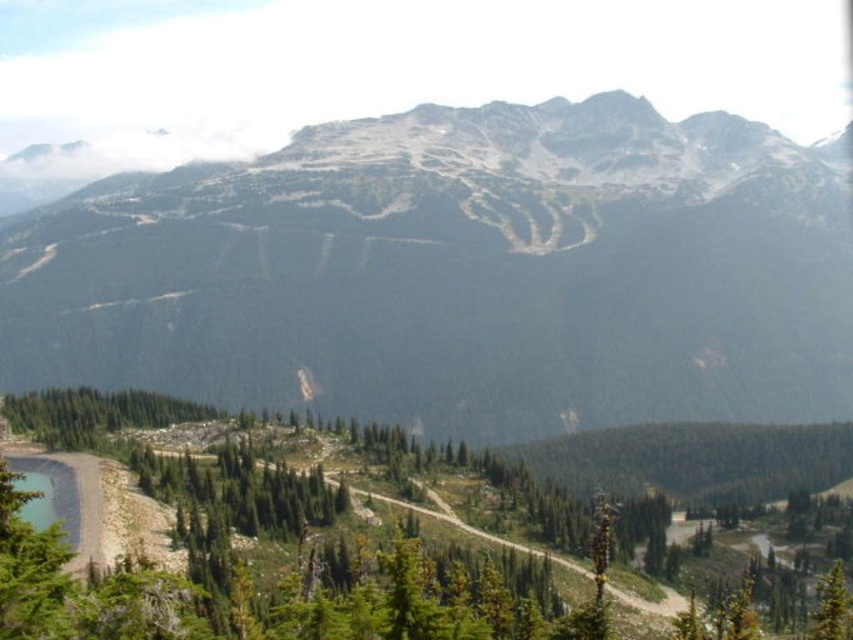
Question: Which of the following is the closest to the observer?

Choices:
 (A) green textured tree at center
 (B) rocky mountain at center
 (C) green matte tree at lower right

Answer: (A)

Question: Which point is closer to the camera?

Choices:
 (A) green textured tree at center
 (B) rocky mountain at center
 (C) green matte tree at lower right

Answer: (A)

Question: Which object is closer to the camera taking this photo?

Choices:
 (A) green textured tree at center
 (B) green matte tree at lower right

Answer: (A)

Question: Can you confirm if rocky mountain at center is smaller than green textured tree at center?

Choices:
 (A) no
 (B) yes

Answer: (A)

Question: Is rocky mountain at center further to the viewer compared to green matte tree at lower right?

Choices:
 (A) no
 (B) yes

Answer: (B)

Question: Can you confirm if rocky mountain at center is positioned below green matte tree at lower right?

Choices:
 (A) yes
 (B) no

Answer: (B)